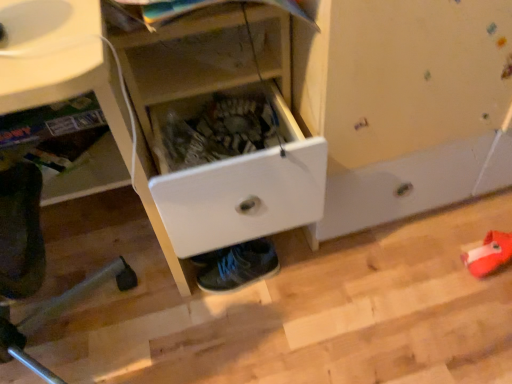
You are a GUI agent. You are given a task and a screenshot of the screen. Output one action in this format:
    pyautogui.click(x=<x>, y=<y>)
    Task: Click on the vacant space to the left of shiny blue sneakers at lower center
    The image size is (512, 384).
    Given the screenshot: What is the action you would take?
    pyautogui.click(x=165, y=299)